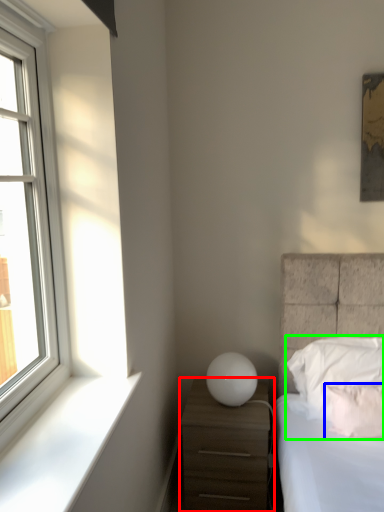
Question: Considering the real-world distances, which object is closest to nightstand (highlighted by a red box)? pillow (highlighted by a blue box) or pillow (highlighted by a green box).

Choices:
 (A) pillow
 (B) pillow

Answer: (B)